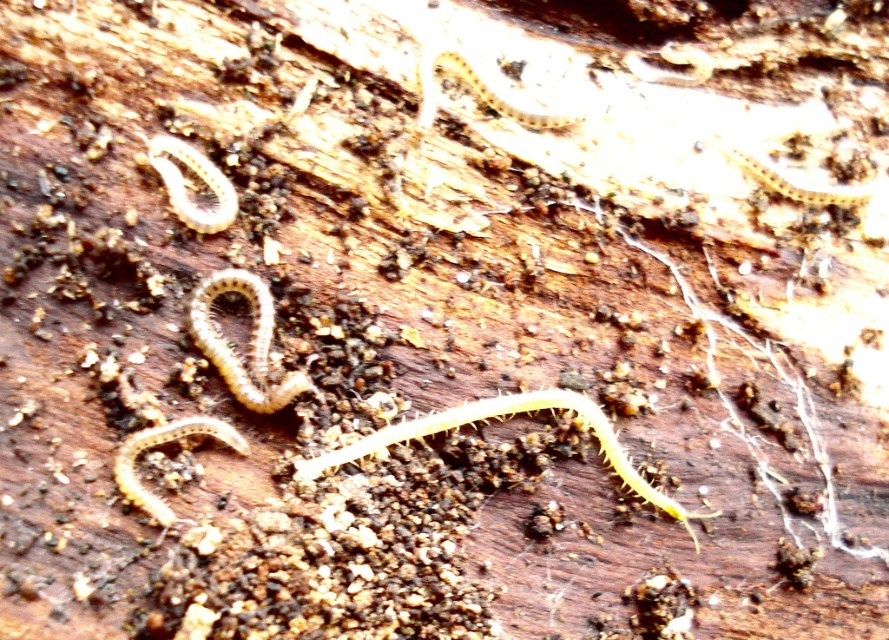
You are a photographer trying to capture a close detail of the centipedes on the decaying wood. You notice two points of interest marked as point 1 at coordinates (x=486, y=104) and point 2 at (x=174, y=192). Which point should you focus on first if you want to ensure both are in sharp focus without adjusting your camera settings?

You should focus on point 1 at coordinates (x=486, y=104) first because it is further away from the camera than point 2 at (x=174, y=192). By focusing on the farther point, the closer point will also be within the depth of field, ensuring both are in sharp focus without needing to adjust the camera settings.

You are a photographer trying to capture a closeup of the centipedes on the decaying wood. You want to focus on the point at coordinates point (x=259, y=330). If your camera requires a focus distance of exactly 4.30 feet to capture sharp details, will this point be in focus?

The distance of point (x=259, y=330) from the camera is exactly 4.30 feet, so yes, the point will be in focus as it matches the required focus distance.